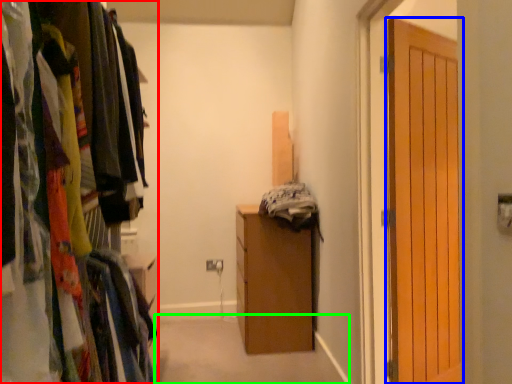
Question: Based on their relative distances, which object is farther from cabinetry (highlighted by a red box)? Choose from door (highlighted by a blue box) and path (highlighted by a green box).

Choices:
 (A) door
 (B) path

Answer: (B)